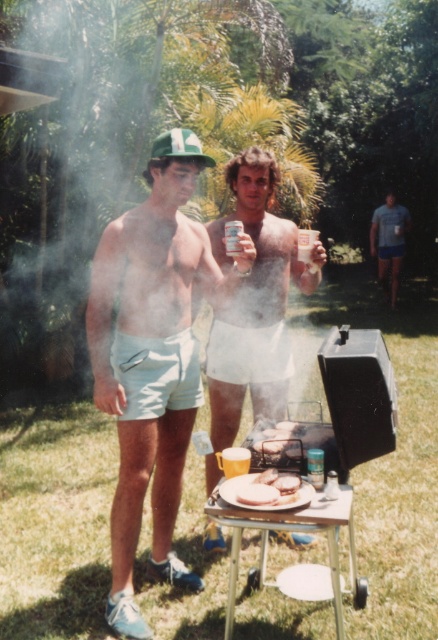
In the scene shown: You are a photographer trying to capture a candid shot of both the white matte shorts at center and the blue cotton shirt at right without any obstructions. Based on their positions, which subject should you focus on first to ensure both are visible in the frame?

The white matte shorts at center is in front of the blue cotton shirt at right, so you should focus on capturing the blue cotton shirt at right first to ensure both are visible without obstruction.

You are a photographer taking a picture of the barbecue scene. You need to ensure that both the white matte shorts at center and the blue cotton shirt at right are clearly visible in the frame. Which clothing item is shorter in height and might require adjusting the camera angle to avoid being obscured?

The white matte shorts at center is shorter than the blue cotton shirt at right, so the white matte shorts at center might be partially obscured and require adjusting the camera angle to ensure visibility.